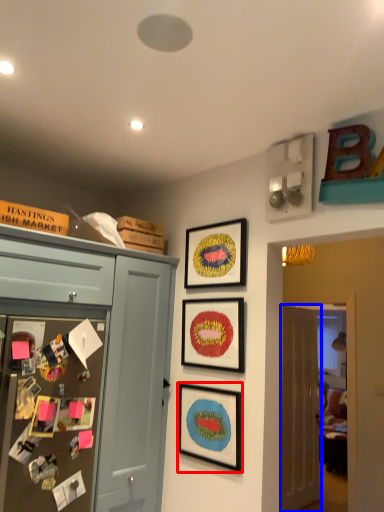
Question: Which of the following is the closest to the observer, picture frame (highlighted by a red box) or door (highlighted by a blue box)?

Choices:
 (A) picture frame
 (B) door

Answer: (A)